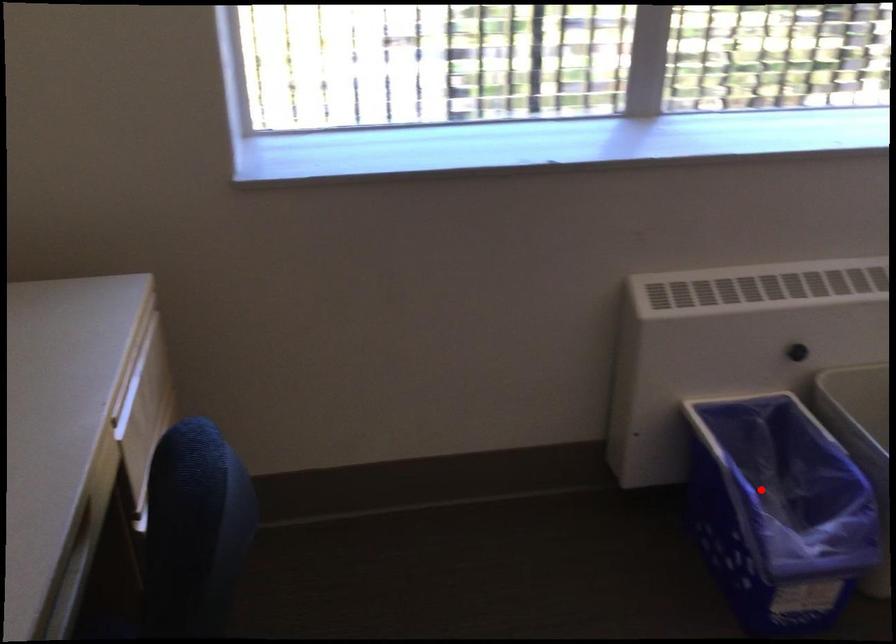
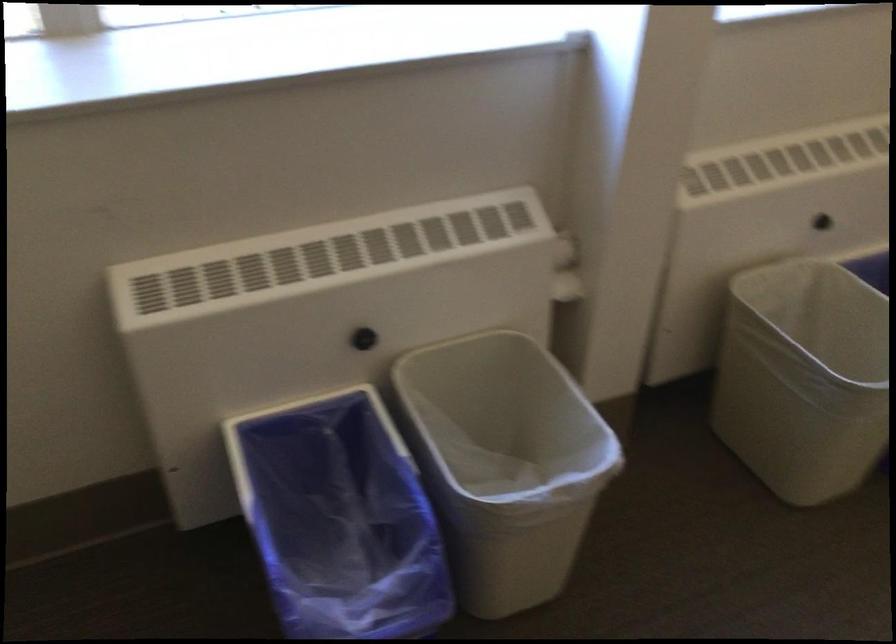
Question: I am providing you with two images of the same scene from different viewpoints. In image1, a red point is highlighted. Considering the same 3D point in image2, which of the following is correct?

Choices:
 (A) It is closer
 (B) It is farther

Answer: (A)